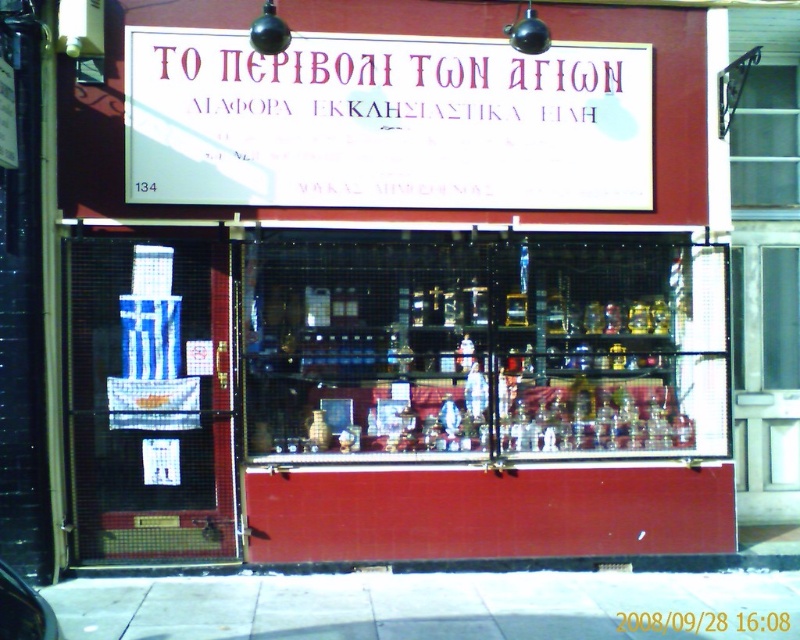
Question: Observing the image, what is the correct spatial positioning of white paper sign at upper center in reference to white concrete pavement at lower center?

Choices:
 (A) left
 (B) right

Answer: (A)

Question: Which object is farther from the camera taking this photo?

Choices:
 (A) white concrete pavement at lower center
 (B) white paper sign at upper center

Answer: (B)

Question: Is white paper sign at upper center wider than white concrete pavement at lower center?

Choices:
 (A) no
 (B) yes

Answer: (A)

Question: Is white paper sign at upper center smaller than white concrete pavement at lower center?

Choices:
 (A) no
 (B) yes

Answer: (A)

Question: Which point is closer to the camera taking this photo?

Choices:
 (A) click(x=68, y=609)
 (B) click(x=424, y=113)

Answer: (A)

Question: Which of the following is the closest to the observer?

Choices:
 (A) white paper sign at upper center
 (B) white concrete pavement at lower center

Answer: (B)